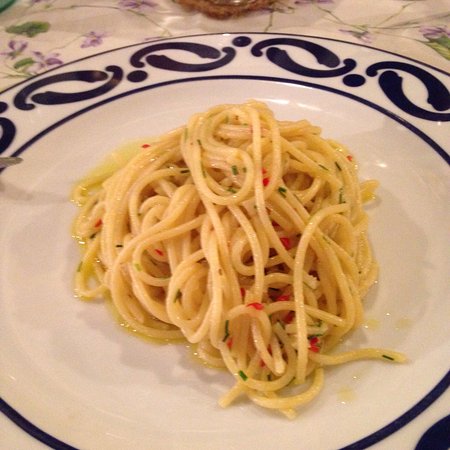
The height and width of the screenshot is (450, 450). Find the location of `tablecloth`. tablecloth is located at coordinates (36, 44), (432, 40).